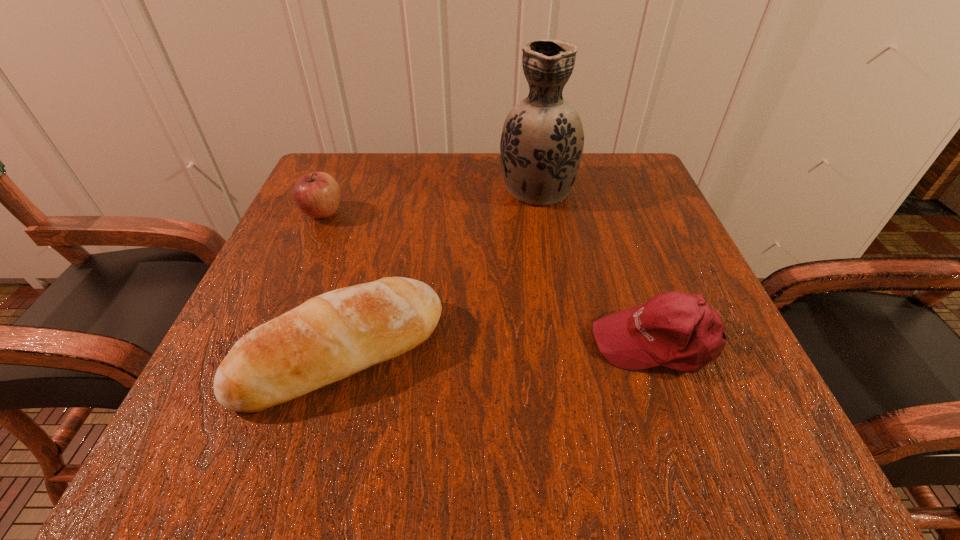
Image resolution: width=960 pixels, height=540 pixels. I want to click on vacant area at the right edge of the desktop, so click(x=637, y=283).

I want to click on vacant space at the far left corner of the desktop, so click(x=355, y=177).

You are a GUI agent. You are given a task and a screenshot of the screen. Output one action in this format:
    pyautogui.click(x=<x>, y=<y>)
    Task: Click on the blank space at the near left corner of the desktop
    
    Given the screenshot: What is the action you would take?
    pyautogui.click(x=300, y=421)

I want to click on free location at the far right corner, so click(589, 191).

Where is `vacant space at the near right corner of the desktop`? vacant space at the near right corner of the desktop is located at coordinates (682, 408).

Identify the location of vacant space in between the apple and the vase. The width and height of the screenshot is (960, 540). (430, 200).

The width and height of the screenshot is (960, 540). Identify the location of free space that is in between the apple and the baseball cap. (491, 278).

Where is `free area in between the baseball cap and the bread`? free area in between the baseball cap and the bread is located at coordinates (499, 347).

What are the coordinates of `empty location between the bread and the baseball cap` in the screenshot? It's located at (499, 347).

The height and width of the screenshot is (540, 960). Identify the location of vacant area that lies between the apple and the bread. (332, 283).